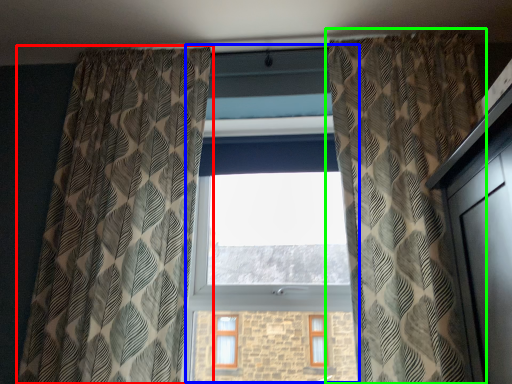
Question: Based on their relative distances, which object is nearer to curtain (highlighted by a red box)? Choose from bay window (highlighted by a blue box) and curtain (highlighted by a green box).

Choices:
 (A) bay window
 (B) curtain

Answer: (A)